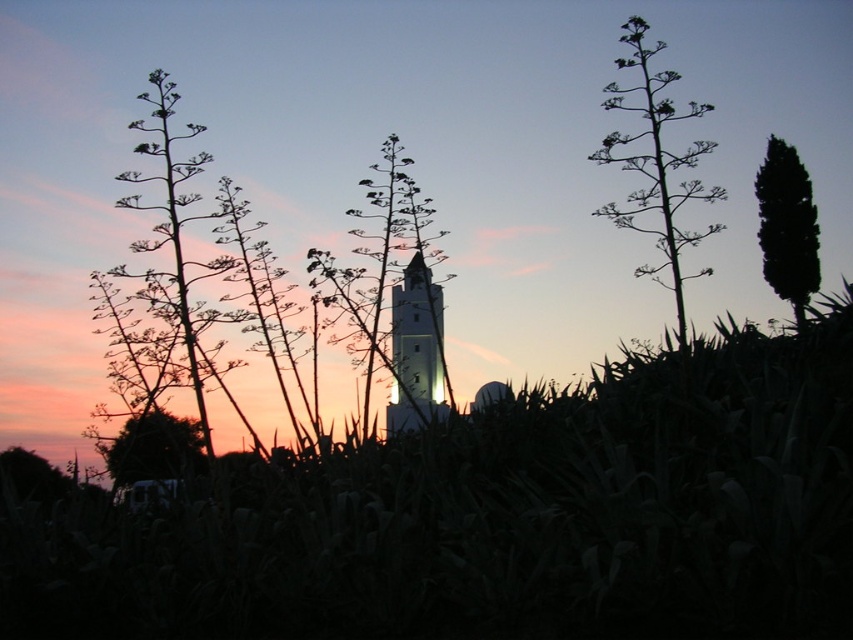
You are an artist trying to sketch the sunset scene. You need to place the green leafy plant at center and the silhouette leafy plant at left in your drawing. Based on the scene description, which plant should you draw first to ensure proper positioning?

The silhouette leafy plant at left should be drawn first because the green leafy plant at center is positioned on the right side of it, meaning the silhouette leafy plant at left is on the left side and closer to the edge, establishing the base for the other plant.

You are a landscape photographer planning to capture the sunset scene with the green leafy plant at center and the silhouette leafy plant at left. Which plant will appear larger in your photo?

The green leafy plant at center will appear larger in the photo because it is bigger than the silhouette leafy plant at left.

You are an architect designing a garden layout. You have two green leafy plants to place in your design. The scene shows a green leafy plant at upper right and a green leafy plant at lower left. Which of these two plants should you choose if you want a larger plant for a focal point?

The green leafy plant at upper right is larger in size than the green leafy plant at lower left, so it would be the better choice for a focal point.